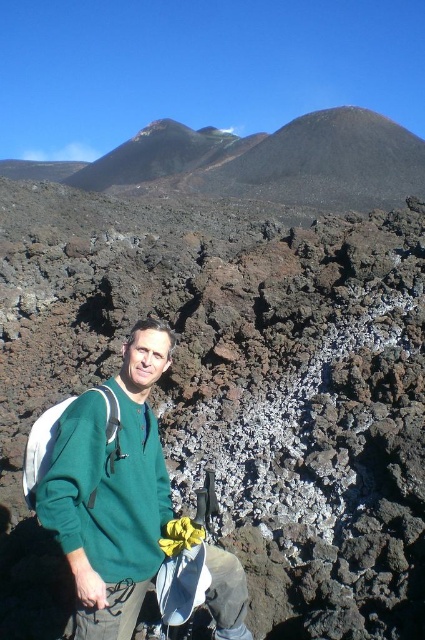
Between green matte sweater at center and green fleece sweatshirt at center, which one has less height?

green fleece sweatshirt at center is shorter.

Who is taller, green matte sweater at center or green fleece sweatshirt at center?

green matte sweater at center

Where is `green matte sweater at center`? Image resolution: width=425 pixels, height=640 pixels. green matte sweater at center is located at coordinates point(115,492).